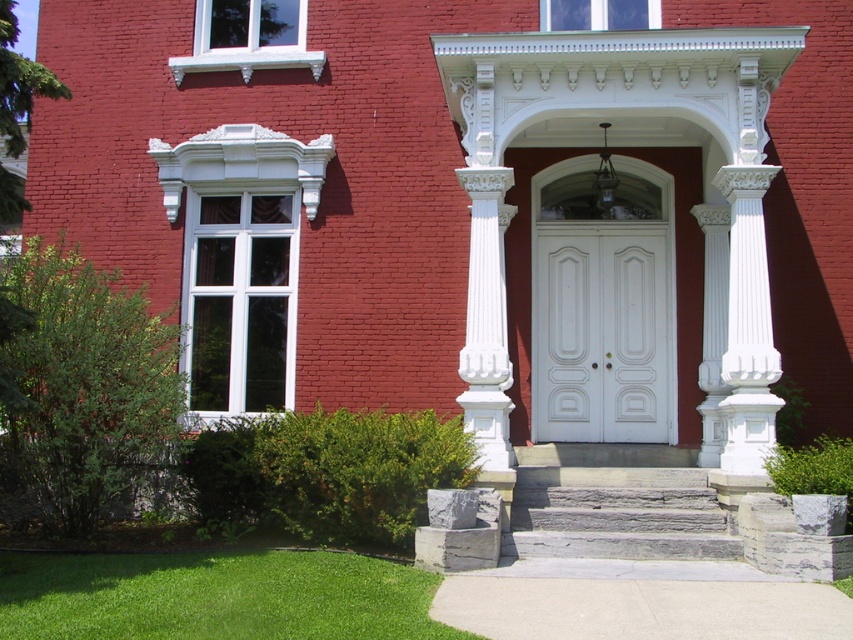
You are standing in front of the red brick building and want to walk towards the entrance. Which direction should you move from the green grass at lower left to reach the gray stone stairs at center?

You should move to the right from the green grass at lower left to reach the gray stone stairs at center since the green grass at lower left is located to the left of the gray stone stairs at center.

You are a painter who needs to know the relative sizes of the objects in the scene to plan your painting. Which object is taller between the white smooth door at center and the gray stone stairs at center?

The white smooth door at center is taller than the gray stone stairs at center according to the description.

You are standing at the entrance of the red brick building and see a point marked at coordinates (216, 596). What is located at this point?

The point at coordinates (216, 596) is occupied by green grass at lower left.